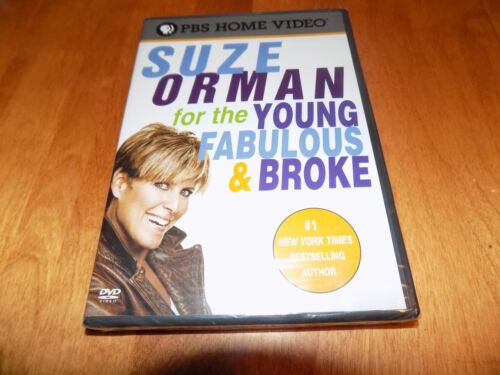
Where is `table`? table is located at coordinates (76, 119).